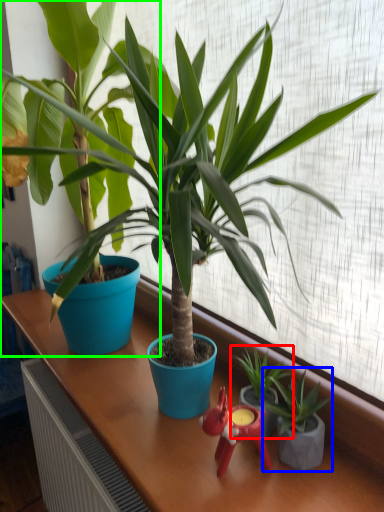
Question: Which is farther away from houseplant (highlighted by a red box)? houseplant (highlighted by a blue box) or houseplant (highlighted by a green box)?

Choices:
 (A) houseplant
 (B) houseplant

Answer: (B)